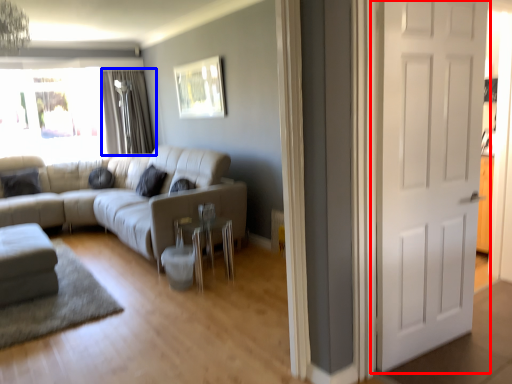
Question: Which object is further to the camera taking this photo, door (highlighted by a red box) or curtain (highlighted by a blue box)?

Choices:
 (A) door
 (B) curtain

Answer: (B)